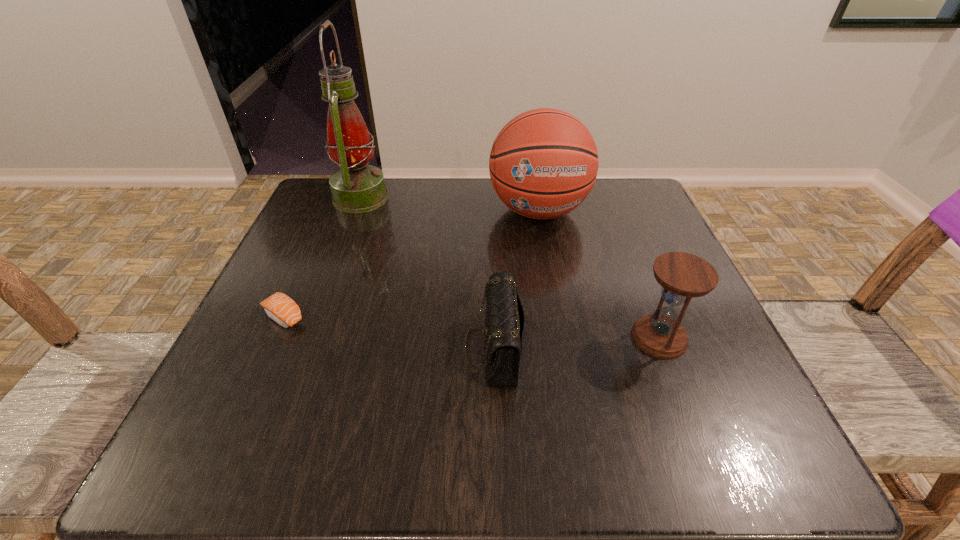
At what (x,y) coordinates should I click in order to perform the action: click on vacant space that is in between the second tallest object and the shortest object. Please return your answer as a coordinate pair (x, y). Looking at the image, I should click on (411, 264).

Locate an element on the screen. This screenshot has height=540, width=960. free space between the basketball and the third shortest object is located at coordinates (599, 274).

I want to click on free space that is in between the hourglass and the clutch bag, so click(x=576, y=342).

This screenshot has height=540, width=960. What are the coordinates of `empty space between the sushi and the hourglass` in the screenshot? It's located at (471, 327).

At what (x,y) coordinates should I click in order to perform the action: click on vacant point located between the sushi and the basketball. Please return your answer as a coordinate pair (x, y). This screenshot has height=540, width=960. Looking at the image, I should click on (411, 264).

Identify the location of vacant space that is in between the sushi and the fourth tallest object. (388, 333).

Select which object is the fourth closest to the basketball. Please provide its 2D coordinates. Your answer should be formatted as a tuple, i.e. [(x, y)], where the tuple contains the x and y coordinates of a point satisfying the conditions above.

[(279, 307)]

This screenshot has height=540, width=960. Find the location of `object that ranks as the third closest to the oil lamp`. object that ranks as the third closest to the oil lamp is located at coordinates (505, 320).

Locate an element on the screen. free spot that satisfies the following two spatial constraints: 1. on the back side of the oil lamp; 2. on the right side of the sushi is located at coordinates (337, 198).

You are a GUI agent. You are given a task and a screenshot of the screen. Output one action in this format:
    pyautogui.click(x=<x>, y=<y>)
    Task: Click on the vacant region that satisfies the following two spatial constraints: 1. on the logo side of the basketball; 2. on the left side of the hourglass
    Image resolution: width=960 pixels, height=540 pixels.
    Given the screenshot: What is the action you would take?
    pyautogui.click(x=561, y=338)